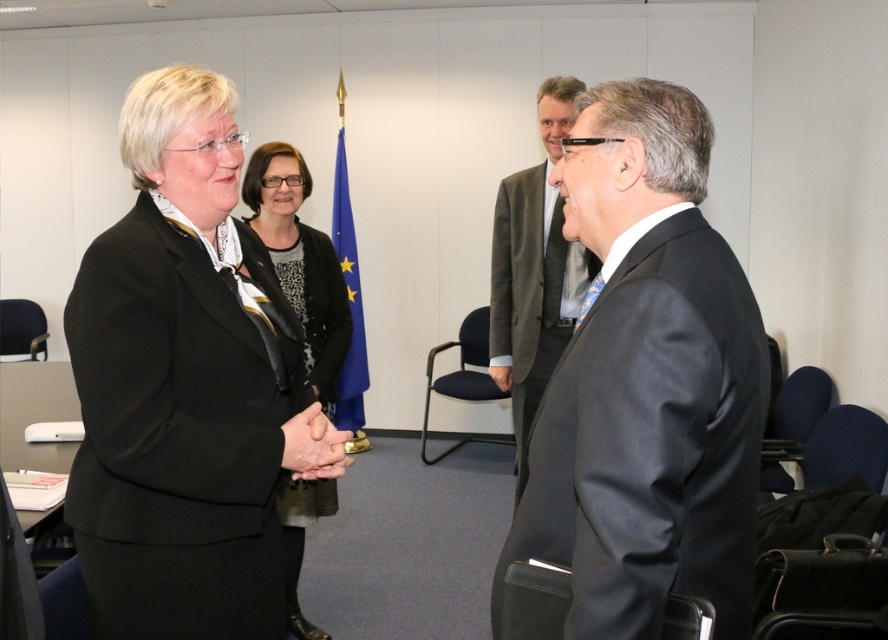
You are standing at point (284, 248) and want to walk to point (191, 497). Are you facing the same direction as the woman in the scene?

Yes, because point (191, 497) is in front of point (284, 248), so walking towards it would mean facing the same direction as the woman.

You are a security guard in the room and need to locate the black matte suit at center. According to the coordinates provided, where should you look to find it?

The black matte suit at center is located at coordinates point [181,385].

You are a photographer positioned at the back of the room. You want to take a photo of both the black matte suit at center and the dark gray suit at center. Which suit will appear larger in the photo?

The black matte suit at center will appear larger in the photo because it is closer to the viewer than the dark gray suit at center.